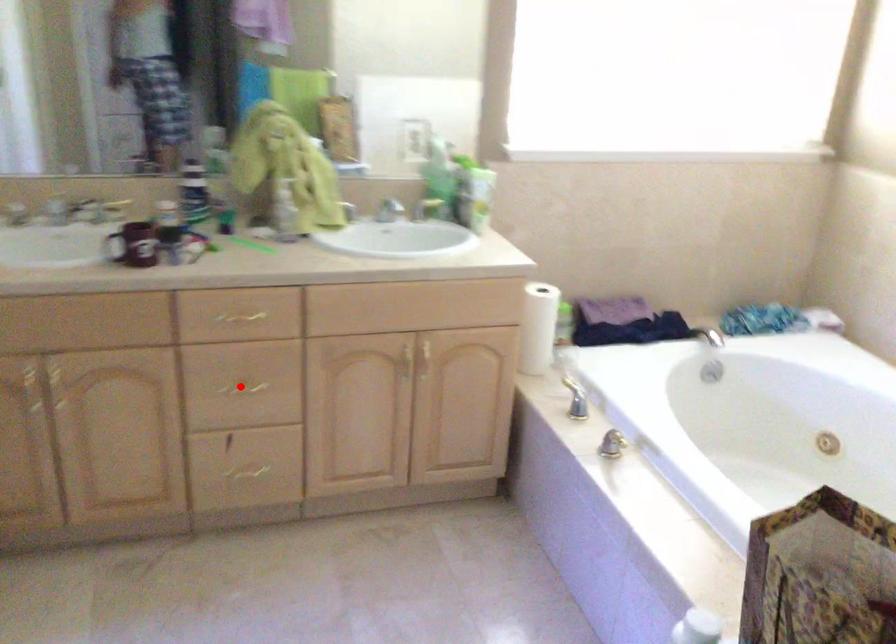
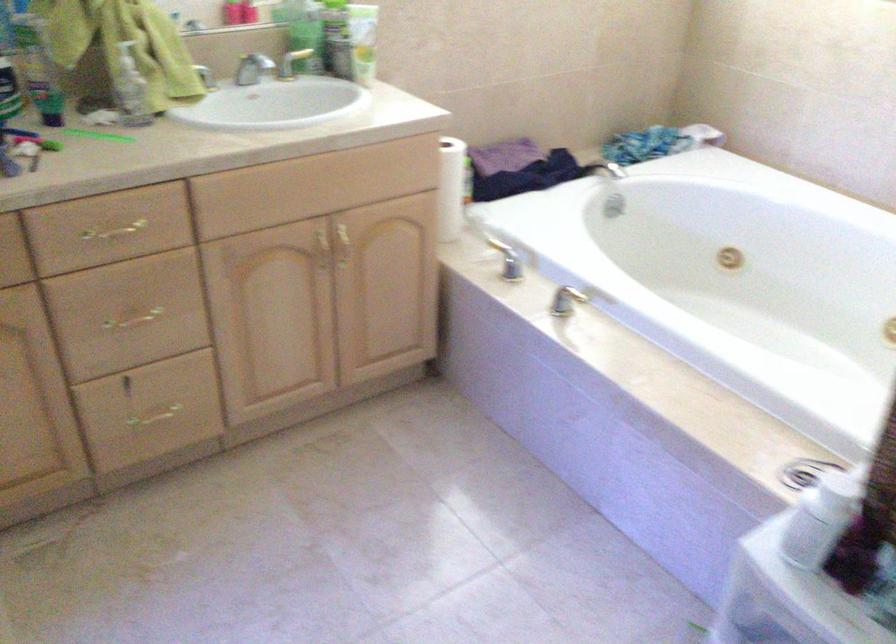
Question: I am providing you with two images of the same scene from different viewpoints. In image1, a red point is highlighted. Considering the same 3D point in image2, which of the following is correct?

Choices:
 (A) It is closer
 (B) It is farther

Answer: (A)